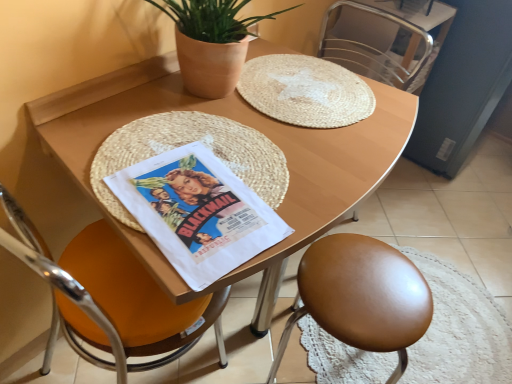
Locate an element on the screen. free spot above brown leather stool at lower right, the 2th chair positioned from the left (from a real-world perspective) is located at coordinates (372, 282).